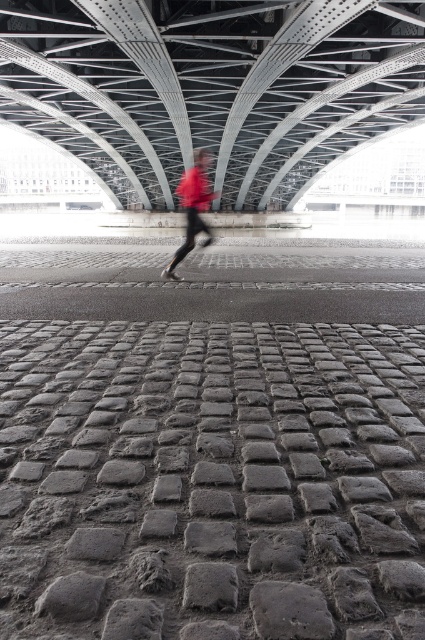
You are a photographer trying to capture the entire scene under the bridge. Given that the gray cobblestone pavement at center and the metallic gray bridge at center are both in view, which object would appear smaller in your photo?

The gray cobblestone pavement at center appears smaller than the metallic gray bridge at center in the photo.

You are a delivery drone that needs to fly from the gray cobblestone pavement at center to the metallic gray bridge at center. What is the minimum distance you must cover to reach the destination?

The minimum distance you must cover to reach the destination is 23.51 meters.

You are a photographer trying to capture the red fabric pants at center and the gray cobblestone pavement at center in a single frame. Based on their widths, which object should you focus on to ensure both fit in the frame?

The gray cobblestone pavement at center has a lesser width compared to red fabric pants at center, so you should focus on the wider red fabric pants at center to ensure both fit in the frame.